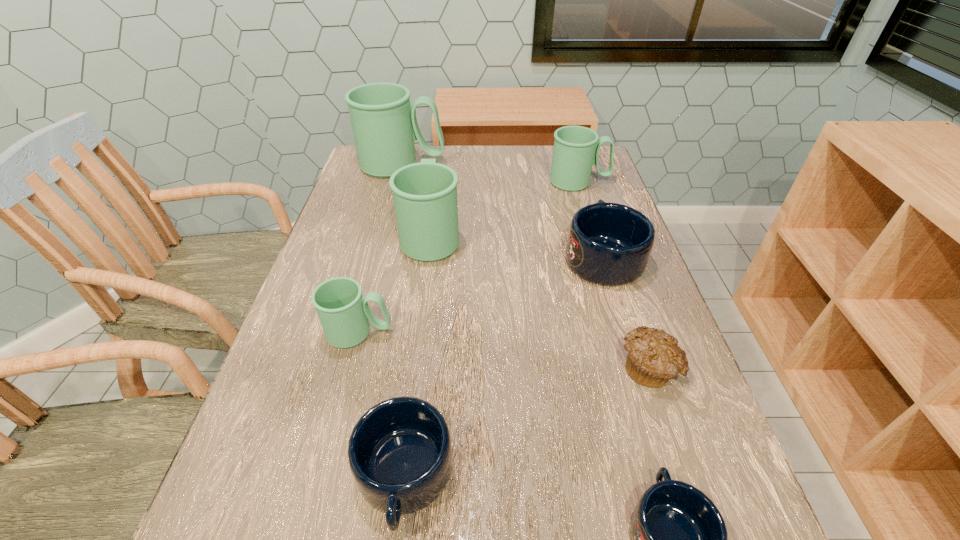
Where is `free location that satisfies the following two spatial constraints: 1. on the side of the sixth shortest object with the handle; 2. with the handle on the side of the farthest blue mug`? free location that satisfies the following two spatial constraints: 1. on the side of the sixth shortest object with the handle; 2. with the handle on the side of the farthest blue mug is located at coordinates (602, 256).